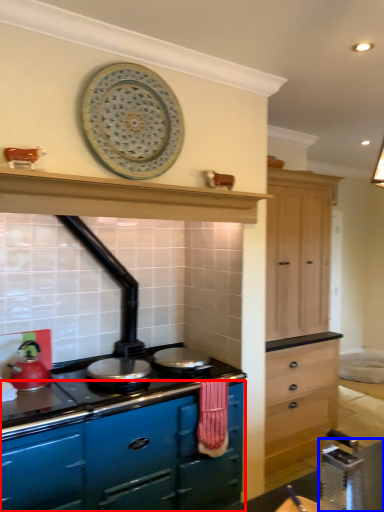
Question: Among these objects, which one is nearest to the camera, cabinetry (highlighted by a red box) or table (highlighted by a blue box)?

Choices:
 (A) cabinetry
 (B) table

Answer: (B)